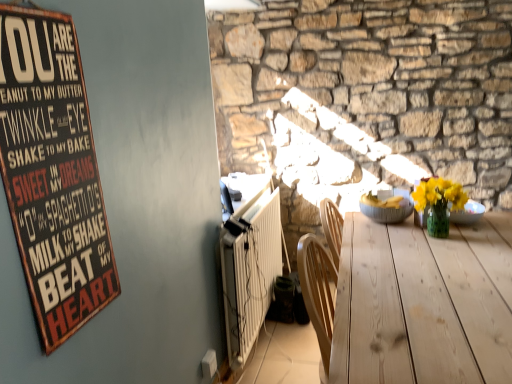
In order to face light wood table at center, should I rotate leftwards or rightwards?

You should look right and rotate roughly 14.931 degrees.

You are a GUI agent. You are given a task and a screenshot of the screen. Output one action in this format:
    pyautogui.click(x=<x>, y=<y>)
    Task: Click on the white ribbed radiator at lower left
    The width and height of the screenshot is (512, 384).
    Given the screenshot: What is the action you would take?
    click(250, 270)

From a real-world perspective, is white ribbed radiator at lower left under gray textured bowl at center?

Yes, from a real-world perspective, white ribbed radiator at lower left is under gray textured bowl at center.

Does white ribbed radiator at lower left appear on the right side of gray textured bowl at center?

No.

Between white ribbed radiator at lower left and gray textured bowl at center, which one is positioned behind?

gray textured bowl at center.

Is white ribbed radiator at lower left not near gray textured bowl at center?

No, there isn't a large distance between white ribbed radiator at lower left and gray textured bowl at center.

Does point (374, 195) appear closer or farther from the camera than point (250, 231)?

Point (374, 195) is positioned farther from the camera compared to point (250, 231).

From a real-world perspective, is gray textured bowl at center above or below white ribbed radiator at lower left?

Clearly, from a real-world perspective, gray textured bowl at center is above white ribbed radiator at lower left.

Consider the image. Is gray textured bowl at center completely or partially outside of white ribbed radiator at lower left?

That's correct, gray textured bowl at center is outside of white ribbed radiator at lower left.

Is the depth of gray textured bowl at center less than that of white ribbed radiator at lower left?

Answer: No, the depth of gray textured bowl at center is greater than that of white ribbed radiator at lower left.

Locate an element on the screen. This screenshot has height=384, width=512. bowl above the light wood table at center (from the image's perspective) is located at coordinates (386, 208).

Is light wood table at center surrounding gray textured bowl at center?

Actually, gray textured bowl at center is outside light wood table at center.

Are light wood table at center and gray textured bowl at center located far from each other?

That's not correct — light wood table at center is a little close to gray textured bowl at center.

Looking at this image, is light wood table at center aimed at gray textured bowl at center?

No, light wood table at center is not oriented towards gray textured bowl at center.

Considering the sizes of wooden signboard at left and gray textured bowl at center in the image, is wooden signboard at left taller or shorter than gray textured bowl at center?

Clearly, wooden signboard at left is taller compared to gray textured bowl at center.

Find the location of a particular element. The image size is (512, 384). bowl behind the wooden signboard at left is located at coordinates (386, 208).

Is gray textured bowl at center at the back of wooden signboard at left?

That's not correct — wooden signboard at left is not looking away from gray textured bowl at center.

Between wooden signboard at left and gray textured bowl at center, which one has smaller size?

wooden signboard at left is smaller.

Looking at this image, from the image's perspective, is light wood table at center on wooden signboard at left?

No.

Which object is positioned more to the left, light wood table at center or wooden signboard at left?

Positioned to the left is wooden signboard at left.

Consider the image. Is light wood table at center facing towards wooden signboard at left?

No, light wood table at center does not turn towards wooden signboard at left.

Does light wood table at center have a smaller size compared to wooden signboard at left?

→ Incorrect, light wood table at center is not smaller in size than wooden signboard at left.

Consider the image. In terms of height, does gray textured bowl at center look taller or shorter compared to light wood table at center?

In the image, gray textured bowl at center appears to be shorter than light wood table at center.

Measure the distance between gray textured bowl at center and light wood table at center.

gray textured bowl at center is 19.37 inches from light wood table at center.

From a real-world perspective, is gray textured bowl at center below light wood table at center?

Actually, gray textured bowl at center is physically above light wood table at center in the real world.

Which is further, (x=376, y=206) or (x=403, y=352)?

The point (x=376, y=206) is farther.

Which of these two, white ribbed radiator at lower left or light wood table at center, is smaller?

white ribbed radiator at lower left.

From a real-world perspective, who is located lower, white ribbed radiator at lower left or light wood table at center?

white ribbed radiator at lower left is physically lower.

Is white ribbed radiator at lower left in contact with light wood table at center?

No, white ribbed radiator at lower left is not making contact with light wood table at center.

Considering the positions of objects white ribbed radiator at lower left and light wood table at center in the image provided, who is in front, white ribbed radiator at lower left or light wood table at center?

light wood table at center is in front.

You are a GUI agent. You are given a task and a screenshot of the screen. Output one action in this format:
    pyautogui.click(x=<x>, y=<y>)
    Task: Click on the radiator below the gray textured bowl at center (from a real-world perspective)
    Image resolution: width=512 pixels, height=384 pixels.
    Given the screenshot: What is the action you would take?
    pyautogui.click(x=250, y=270)

The width and height of the screenshot is (512, 384). I want to click on radiator lying on the left of gray textured bowl at center, so click(x=250, y=270).

Estimate the real-world distances between objects in this image. Which object is further from light wood table at center, white ribbed radiator at lower left or gray textured bowl at center?

white ribbed radiator at lower left lies further to light wood table at center than the other object.

In the scene shown: Looking at the image, which one is located further to light wood table at center, wooden signboard at left or white ribbed radiator at lower left?

Among the two, wooden signboard at left is located further to light wood table at center.

From the image, which object appears to be farther from light wood table at center, wooden signboard at left or gray textured bowl at center?

wooden signboard at left is further to light wood table at center.

From the image, which object appears to be farther from gray textured bowl at center, wooden signboard at left or light wood table at center?

Based on the image, wooden signboard at left appears to be further to gray textured bowl at center.

Considering their positions, is gray textured bowl at center positioned closer to light wood table at center than wooden signboard at left?

gray textured bowl at center is closer to light wood table at center.

Based on their spatial positions, is light wood table at center or gray textured bowl at center closer to wooden signboard at left?

light wood table at center lies closer to wooden signboard at left than the other object.

Based on their spatial positions, is light wood table at center or wooden signboard at left further from gray textured bowl at center?

Based on the image, wooden signboard at left appears to be further to gray textured bowl at center.

Estimate the real-world distances between objects in this image. Which object is further from gray textured bowl at center, white ribbed radiator at lower left or light wood table at center?

Among the two, white ribbed radiator at lower left is located further to gray textured bowl at center.

Where is `desk between wooden signboard at left and gray textured bowl at center along the z-axis`? The width and height of the screenshot is (512, 384). desk between wooden signboard at left and gray textured bowl at center along the z-axis is located at coordinates (422, 305).

Identify the location of radiator between light wood table at center and gray textured bowl at center from front to back. point(250,270).

At what (x,y) coordinates should I click in order to perform the action: click on desk between wooden signboard at left and white ribbed radiator at lower left from front to back. Please return your answer as a coordinate pair (x, y). This screenshot has height=384, width=512. Looking at the image, I should click on (422, 305).

You are a GUI agent. You are given a task and a screenshot of the screen. Output one action in this format:
    pyautogui.click(x=<x>, y=<y>)
    Task: Click on the radiator positioned between wooden signboard at left and gray textured bowl at center from near to far
    This screenshot has height=384, width=512.
    Given the screenshot: What is the action you would take?
    pyautogui.click(x=250, y=270)